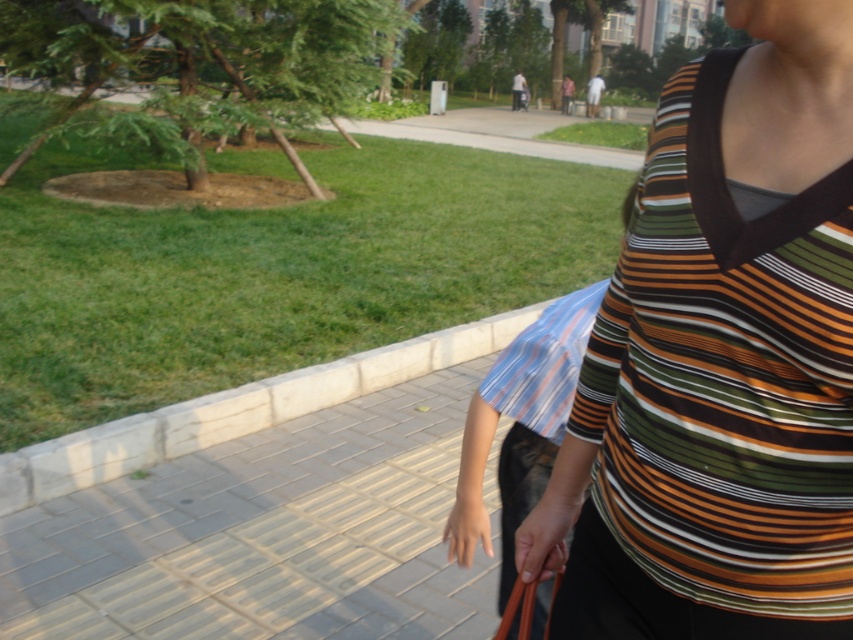
Is striped cotton shirt at right to the left of gray brick pavement at center from the viewer's perspective?

Incorrect, striped cotton shirt at right is not on the left side of gray brick pavement at center.

Is point (772, 477) less distant than point (77, 552)?

That is True.

Is point (694, 292) less distant than point (4, 604)?

Yes, it is.

The height and width of the screenshot is (640, 853). Find the location of `striped cotton shirt at right`. striped cotton shirt at right is located at coordinates (721, 360).